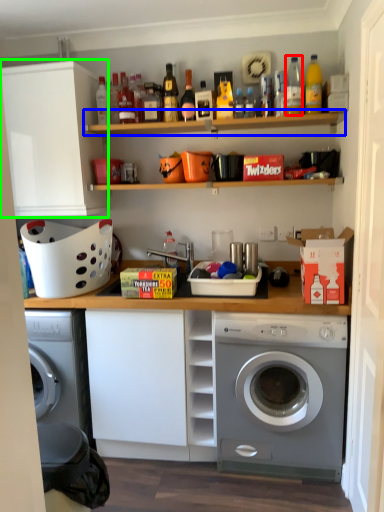
Question: Estimate the real-world distances between objects in this image. Which object is farther from bottle (highlighted by a red box), shelf (highlighted by a blue box) or cabinetry (highlighted by a green box)?

Choices:
 (A) shelf
 (B) cabinetry

Answer: (B)